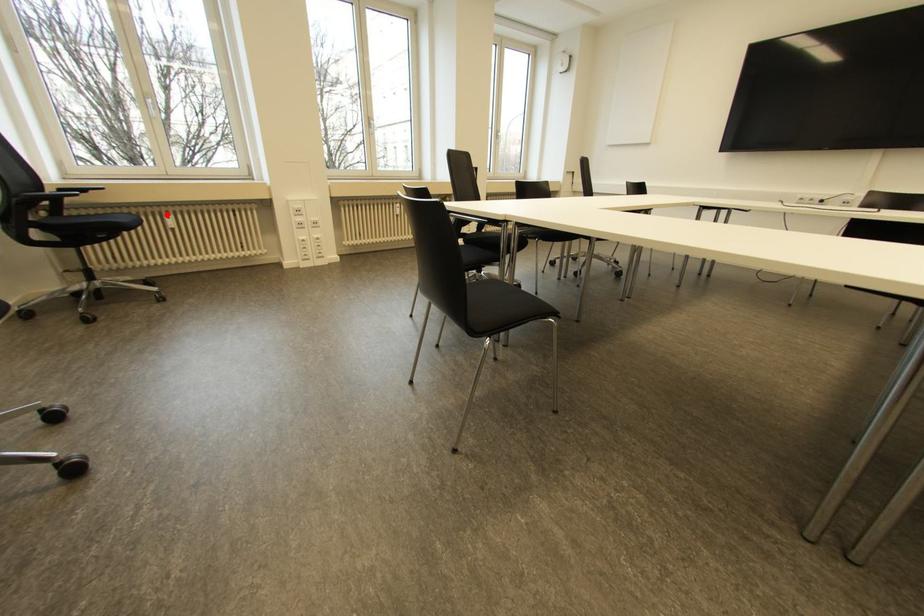
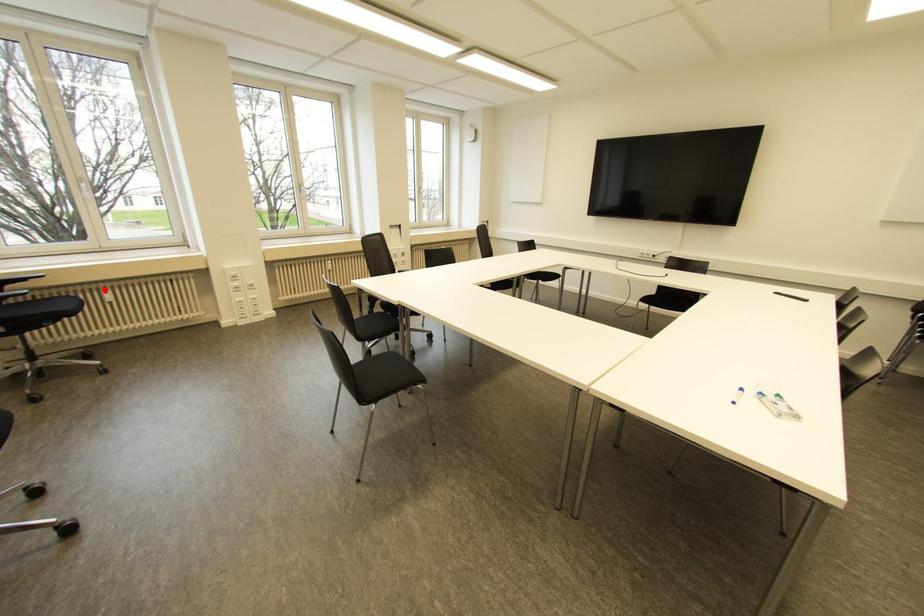
I am providing you with two images of the same scene from different viewpoints. A red point is marked on the first image and another point is marked on the second image. Is the marked point in image1 the same physical position as the marked point in image2?

Yes